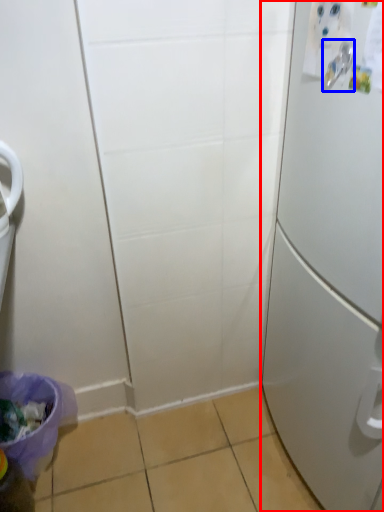
Question: Among these objects, which one is nearest to the camera, refrigerator (highlighted by a red box) or door handle (highlighted by a blue box)?

Choices:
 (A) refrigerator
 (B) door handle

Answer: (A)